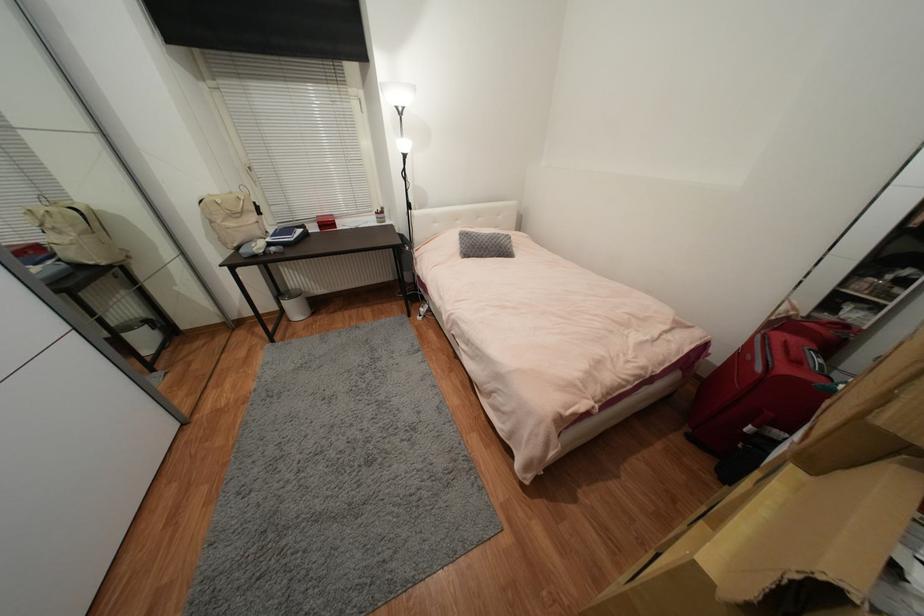
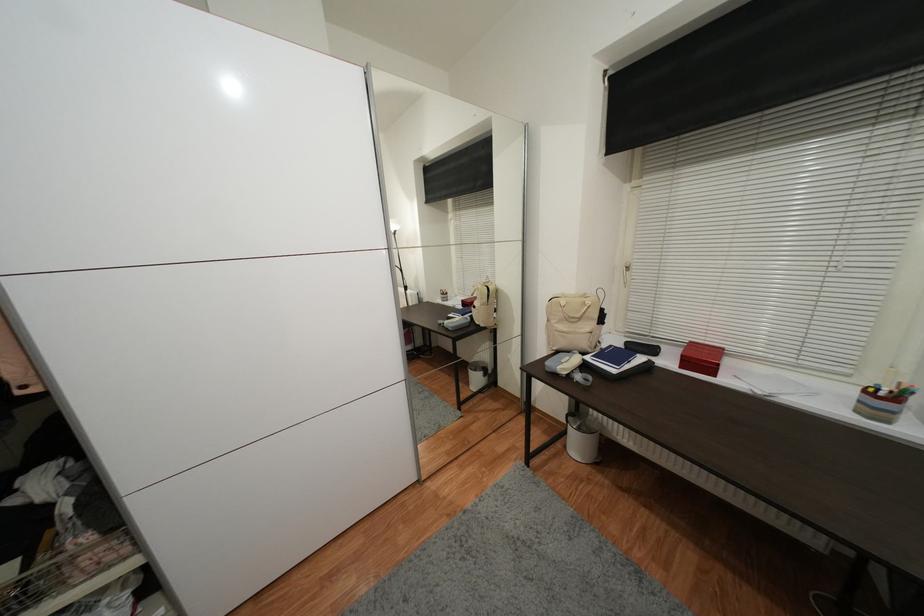
Where in the second image is the point corresponding to point (273, 241) from the first image?

(592, 360)